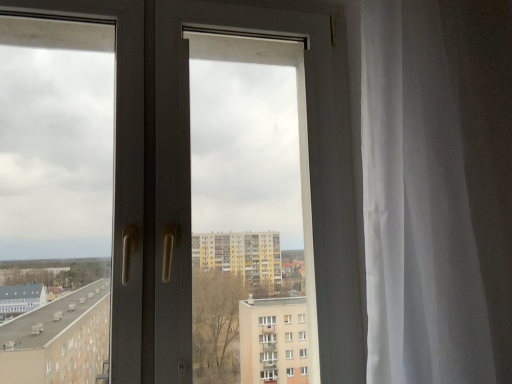
Question: Should I look upward or downward to see white glossy door at center?

Choices:
 (A) up
 (B) down

Answer: (A)

Question: Is white sheer curtain at right at the left side of white glossy door at center?

Choices:
 (A) no
 (B) yes

Answer: (A)

Question: From the image's perspective, is white sheer curtain at right beneath white glossy door at center?

Choices:
 (A) no
 (B) yes

Answer: (A)

Question: From a real-world perspective, is white sheer curtain at right below white glossy door at center?

Choices:
 (A) yes
 (B) no

Answer: (A)

Question: Does white sheer curtain at right have a greater height compared to white glossy door at center?

Choices:
 (A) no
 (B) yes

Answer: (A)

Question: Considering the relative sizes of white sheer curtain at right and white glossy door at center in the image provided, is white sheer curtain at right shorter than white glossy door at center?

Choices:
 (A) yes
 (B) no

Answer: (A)

Question: Does white sheer curtain at right lie behind white glossy door at center?

Choices:
 (A) no
 (B) yes

Answer: (A)

Question: Does white glossy door at center come behind white sheer curtain at right?

Choices:
 (A) yes
 (B) no

Answer: (A)

Question: Does white glossy door at center have a larger size compared to white sheer curtain at right?

Choices:
 (A) yes
 (B) no

Answer: (B)

Question: Is white glossy door at center smaller than white sheer curtain at right?

Choices:
 (A) no
 (B) yes

Answer: (B)

Question: Would you say white glossy door at center contains white sheer curtain at right?

Choices:
 (A) no
 (B) yes

Answer: (A)

Question: Can you confirm if white glossy door at center is thinner than white sheer curtain at right?

Choices:
 (A) yes
 (B) no

Answer: (A)

Question: Are white glossy door at center and white sheer curtain at right beside each other?

Choices:
 (A) no
 (B) yes

Answer: (A)

Question: From the image's perspective, relative to white sheer curtain at right, is white glossy door at center above or below?

Choices:
 (A) below
 (B) above

Answer: (A)